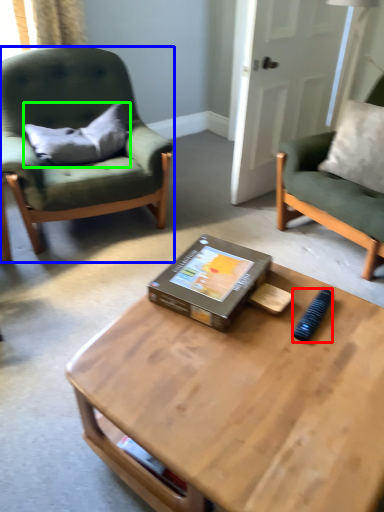
Question: Estimate the real-world distances between objects in this image. Which object is closer to remote control (highlighted by a red box), chair (highlighted by a blue box) or pillow (highlighted by a green box)?

Choices:
 (A) chair
 (B) pillow

Answer: (A)